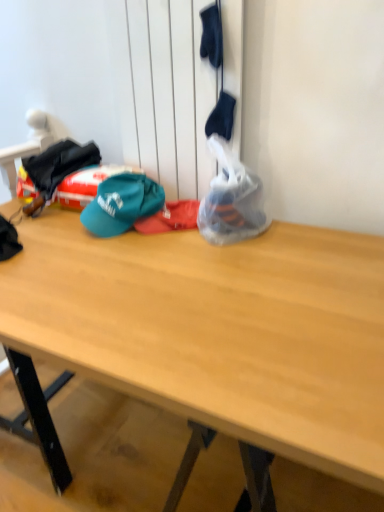
Question: Is teal fabric cap at center located within wooden desk at center?

Choices:
 (A) no
 (B) yes

Answer: (A)

Question: Is wooden desk at center completely or partially outside of teal fabric cap at center?

Choices:
 (A) no
 (B) yes

Answer: (B)

Question: Is wooden desk at center at the right side of teal fabric cap at center?

Choices:
 (A) yes
 (B) no

Answer: (A)

Question: Can you confirm if wooden desk at center is shorter than teal fabric cap at center?

Choices:
 (A) no
 (B) yes

Answer: (B)

Question: Is wooden desk at center aimed at teal fabric cap at center?

Choices:
 (A) yes
 (B) no

Answer: (B)

Question: Visually, is wooden desk at center positioned to the left or to the right of translucent plastic bag at center?

Choices:
 (A) left
 (B) right

Answer: (A)

Question: Considering their positions, is wooden desk at center located in front of or behind translucent plastic bag at center?

Choices:
 (A) front
 (B) behind

Answer: (A)

Question: Is wooden desk at center inside the boundaries of translucent plastic bag at center, or outside?

Choices:
 (A) outside
 (B) inside

Answer: (A)

Question: In terms of height, does wooden desk at center look taller or shorter compared to translucent plastic bag at center?

Choices:
 (A) tall
 (B) short

Answer: (B)

Question: From a real-world perspective, is translucent plastic bag at center positioned above or below teal fabric cap at center?

Choices:
 (A) below
 (B) above

Answer: (B)

Question: Considering the positions of point (256, 209) and point (92, 209), is point (256, 209) closer or farther from the camera than point (92, 209)?

Choices:
 (A) closer
 (B) farther

Answer: (A)

Question: Is translucent plastic bag at center wider or thinner than teal fabric cap at center?

Choices:
 (A) thin
 (B) wide

Answer: (B)

Question: Looking at the image, does translucent plastic bag at center seem bigger or smaller compared to teal fabric cap at center?

Choices:
 (A) small
 (B) big

Answer: (B)

Question: Is translucent plastic bag at center bigger or smaller than wooden desk at center?

Choices:
 (A) small
 (B) big

Answer: (A)

Question: Do you think translucent plastic bag at center is within wooden desk at center, or outside of it?

Choices:
 (A) outside
 (B) inside

Answer: (A)